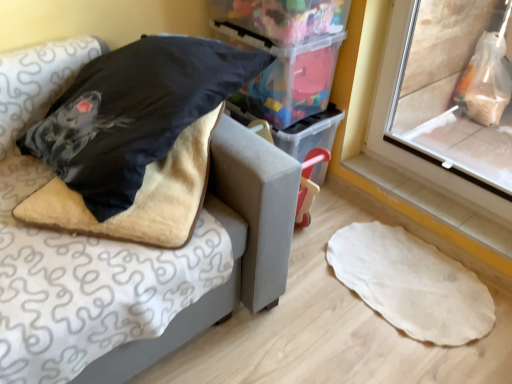
Question: Does translucent plastic storage box at upper center turn towards fuzzy beige blanket at left?

Choices:
 (A) no
 (B) yes

Answer: (A)

Question: Is translucent plastic storage box at upper center in front of fuzzy beige blanket at left?

Choices:
 (A) no
 (B) yes

Answer: (A)

Question: Is translucent plastic storage box at upper center positioned behind fuzzy beige blanket at left?

Choices:
 (A) no
 (B) yes

Answer: (B)

Question: From a real-world perspective, is translucent plastic storage box at upper center beneath fuzzy beige blanket at left?

Choices:
 (A) yes
 (B) no

Answer: (A)

Question: Are translucent plastic storage box at upper center and fuzzy beige blanket at left far apart?

Choices:
 (A) yes
 (B) no

Answer: (B)

Question: From the image's perspective, is translucent plastic storage box at upper center on top of fuzzy beige blanket at left?

Choices:
 (A) yes
 (B) no

Answer: (A)

Question: Does white tile at lower right have a greater height compared to translucent plastic storage box at upper center?

Choices:
 (A) no
 (B) yes

Answer: (A)

Question: From the image's perspective, does white tile at lower right appear lower than translucent plastic storage box at upper center?

Choices:
 (A) no
 (B) yes

Answer: (B)

Question: Is white tile at lower right bigger than translucent plastic storage box at upper center?

Choices:
 (A) yes
 (B) no

Answer: (B)

Question: Does white tile at lower right turn towards translucent plastic storage box at upper center?

Choices:
 (A) no
 (B) yes

Answer: (A)

Question: Is translucent plastic storage box at upper center at the back of white tile at lower right?

Choices:
 (A) no
 (B) yes

Answer: (A)

Question: From a real-world perspective, is white tile at lower right on top of translucent plastic storage box at upper center?

Choices:
 (A) no
 (B) yes

Answer: (A)

Question: Considering the relative positions of transparent plastic window screen at right and velvet-like beige cushion at upper left in the image provided, is transparent plastic window screen at right to the right of velvet-like beige cushion at upper left from the viewer's perspective?

Choices:
 (A) no
 (B) yes

Answer: (B)